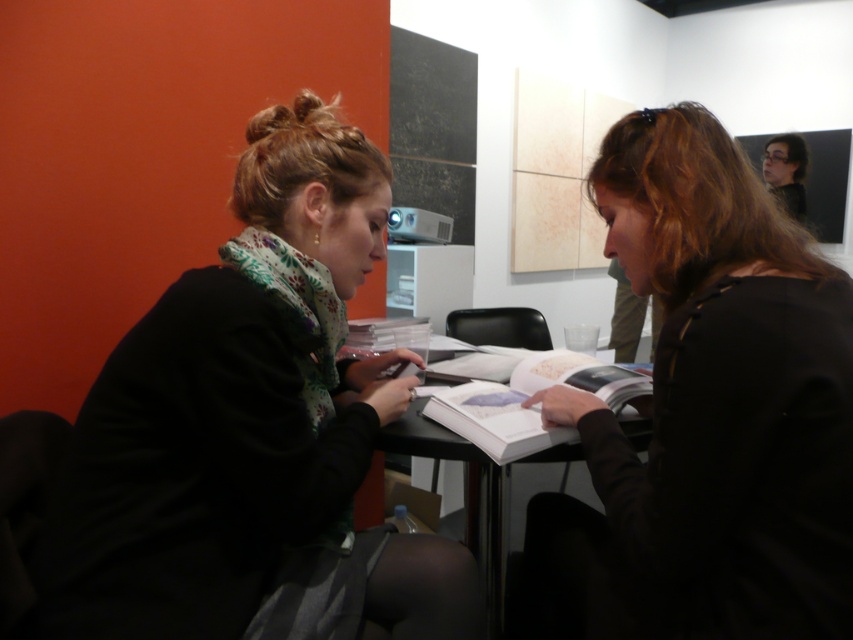
Question: Which object appears closest to the camera in this image?

Choices:
 (A) white paper book at center
 (B) black matte jacket at left

Answer: (B)

Question: Can you confirm if white paper book at center is positioned above black plastic table at center?

Choices:
 (A) yes
 (B) no

Answer: (A)

Question: Can you confirm if black matte jacket at left is wider than black matte jacket at center?

Choices:
 (A) yes
 (B) no

Answer: (A)

Question: Which is nearer to the white paper book at center?

Choices:
 (A) black plastic table at center
 (B) black matte jacket at center
 (C) black matte jacket at left

Answer: (A)

Question: Is white paper book at center further to camera compared to black plastic table at center?

Choices:
 (A) yes
 (B) no

Answer: (B)

Question: Which object is closer to the camera taking this photo?

Choices:
 (A) black matte jacket at center
 (B) black plastic table at center
 (C) white paper book at center
 (D) black matte jacket at left

Answer: (A)